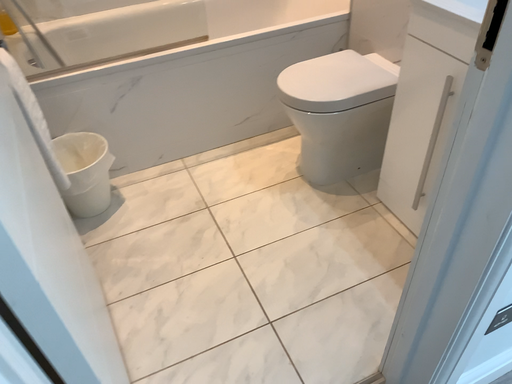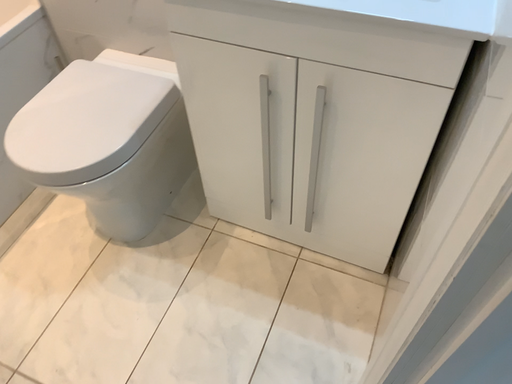
Question: How did the camera likely rotate when shooting the video?

Choices:
 (A) rotated right
 (B) rotated left

Answer: (A)